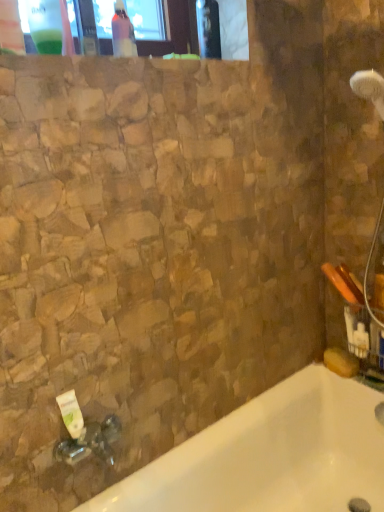
Question: Considering the relative sizes of white glossy bathtub at lower left and transparent plastic bottle at upper left, the 2th bottle viewed from the back, in the image provided, is white glossy bathtub at lower left thinner than transparent plastic bottle at upper left, the 2th bottle viewed from the back,?

Choices:
 (A) no
 (B) yes

Answer: (A)

Question: Is white glossy bathtub at lower left at the left side of transparent plastic bottle at upper left, the first bottle positioned from the front?

Choices:
 (A) no
 (B) yes

Answer: (A)

Question: Is the depth of white glossy bathtub at lower left less than that of transparent plastic bottle at upper left, the 2th bottle viewed from the back?

Choices:
 (A) no
 (B) yes

Answer: (B)

Question: From a real-world perspective, does white glossy bathtub at lower left stand above transparent plastic bottle at upper left, the first bottle positioned from the front?

Choices:
 (A) yes
 (B) no

Answer: (B)

Question: Considering the relative sizes of white glossy bathtub at lower left and transparent plastic bottle at upper left, arranged as the 2th bottle when viewed from the right, in the image provided, is white glossy bathtub at lower left shorter than transparent plastic bottle at upper left, arranged as the 2th bottle when viewed from the right,?

Choices:
 (A) no
 (B) yes

Answer: (A)

Question: Is white glossy bathtub at lower left far from transparent plastic bottle at upper left, which is the first bottle in left-to-right order?

Choices:
 (A) no
 (B) yes

Answer: (B)

Question: From the image's perspective, does pink glossy bottle at upper center, the first bottle in the right-to-left sequence, appear lower than white matte tube at lower left?

Choices:
 (A) no
 (B) yes

Answer: (A)

Question: Is pink glossy bottle at upper center, the second bottle positioned from the left, further to the viewer compared to white matte tube at lower left?

Choices:
 (A) no
 (B) yes

Answer: (B)

Question: Is pink glossy bottle at upper center, which is the 2th bottle from front to back, bigger than white matte tube at lower left?

Choices:
 (A) yes
 (B) no

Answer: (A)

Question: Can you confirm if pink glossy bottle at upper center, which is the first bottle from back to front, is thinner than white matte tube at lower left?

Choices:
 (A) no
 (B) yes

Answer: (A)

Question: Is pink glossy bottle at upper center, the second bottle positioned from the left, shorter than white matte tube at lower left?

Choices:
 (A) yes
 (B) no

Answer: (B)

Question: Is pink glossy bottle at upper center, which is the 2th bottle from front to back, taller than white matte tube at lower left?

Choices:
 (A) no
 (B) yes

Answer: (B)

Question: Is transparent plastic bottle at upper left, the 2th bottle viewed from the back, positioned before pink glossy bottle at upper center, which is the first bottle from back to front?

Choices:
 (A) no
 (B) yes

Answer: (B)